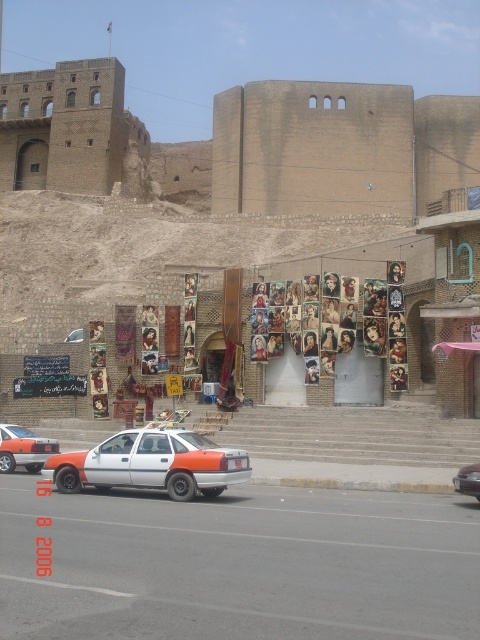
In the scene shown: You are standing at the camera position and want to walk to both points in the image. Which point should you reach first, point (222, 605) or point (21, 435)?

Point (222, 605) is closer to the camera than point (21, 435), so you will reach point (222, 605) first.

You are standing at the origin point in the image. Which direction should you walk to reach the white plastic car at center?

The white plastic car at center is located at coordinates 0.884 on the x axis and 0.500 on the y axis. Since you are at the origin point, you should walk towards the positive x direction to reach it.